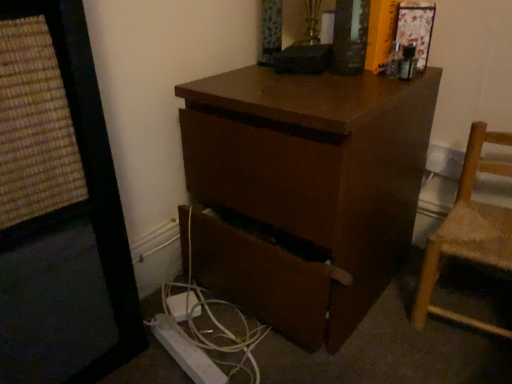
Question: In the image, is light brown woven wood chair at right positioned in front of or behind brown matte desk at center?

Choices:
 (A) behind
 (B) front

Answer: (A)

Question: Is light brown woven wood chair at right inside the boundaries of brown matte desk at center, or outside?

Choices:
 (A) outside
 (B) inside

Answer: (A)

Question: Considering the real-world distances, which object is farthest from the white plastic cable at lower center?

Choices:
 (A) light brown woven wood chair at right
 (B) brown matte desk at center

Answer: (A)

Question: Estimate the real-world distances between objects in this image. Which object is farther from the brown matte desk at center?

Choices:
 (A) light brown woven wood chair at right
 (B) white plastic cable at lower center

Answer: (A)